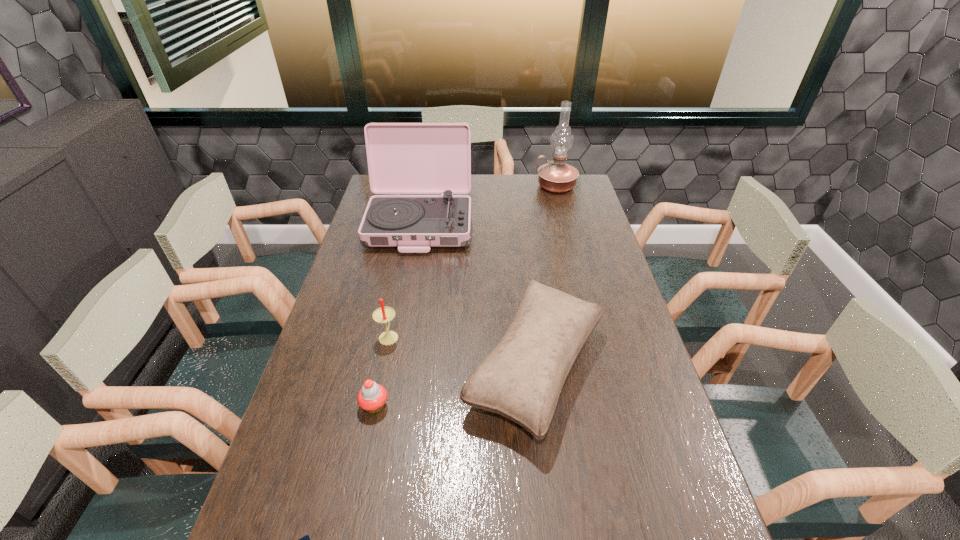
What are the coordinates of `free space that satisfies the following two spatial constraints: 1. on the back side of the farthest object; 2. on the right side of the candle` in the screenshot? It's located at (420, 186).